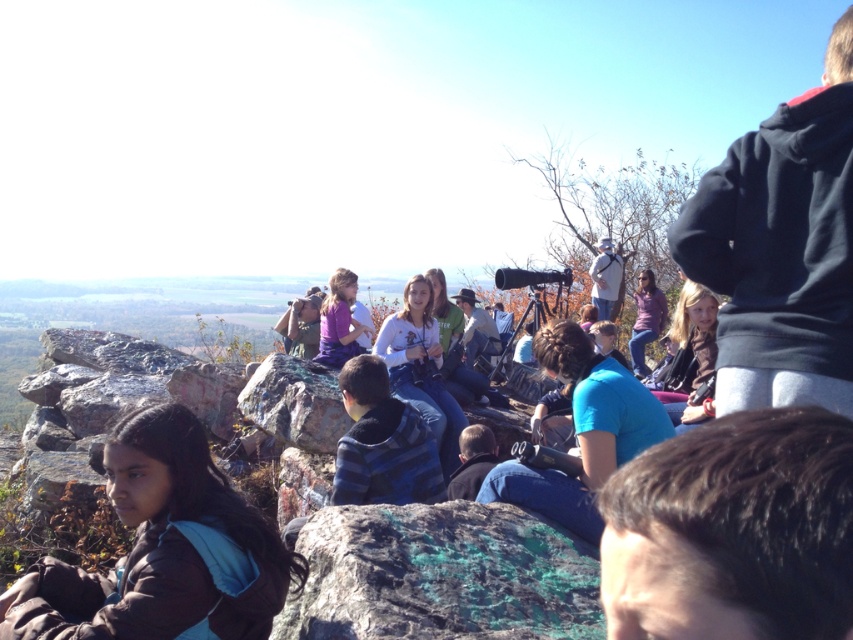
Question: Which object is farther from the camera taking this photo?

Choices:
 (A) green marbled rock at center
 (B) matte purple shirt at center

Answer: (B)

Question: Considering the relative positions of green marbled rock at center and matte purple shirt at center in the image provided, where is green marbled rock at center located with respect to matte purple shirt at center?

Choices:
 (A) right
 (B) left

Answer: (A)

Question: Which point appears farthest from the camera in this image?

Choices:
 (A) (345, 269)
 (B) (457, 584)

Answer: (A)

Question: Can you confirm if green marbled rock at center is positioned below matte purple shirt at center?

Choices:
 (A) no
 (B) yes

Answer: (B)

Question: Is green marbled rock at center behind matte purple shirt at center?

Choices:
 (A) yes
 (B) no

Answer: (B)